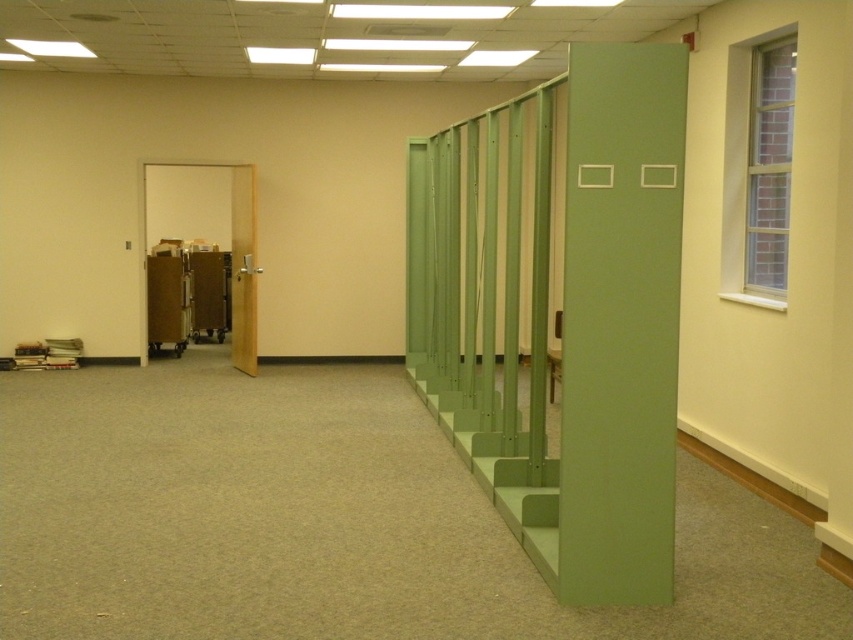
Question: Which object appears farthest from the camera in this image?

Choices:
 (A) green matte locker at right
 (B) matte wood door at left

Answer: (B)

Question: Can you confirm if green matte locker at right is positioned above matte wood door at left?

Choices:
 (A) yes
 (B) no

Answer: (B)

Question: Is green matte locker at right smaller than matte wood door at left?

Choices:
 (A) yes
 (B) no

Answer: (A)

Question: Which object appears farthest from the camera in this image?

Choices:
 (A) matte wood door at left
 (B) green matte locker at right

Answer: (A)

Question: From the image, what is the correct spatial relationship of green matte locker at right in relation to matte wood door at left?

Choices:
 (A) below
 (B) above

Answer: (A)

Question: Among these objects, which one is farthest from the camera?

Choices:
 (A) green matte locker at right
 (B) matte wood door at left

Answer: (B)